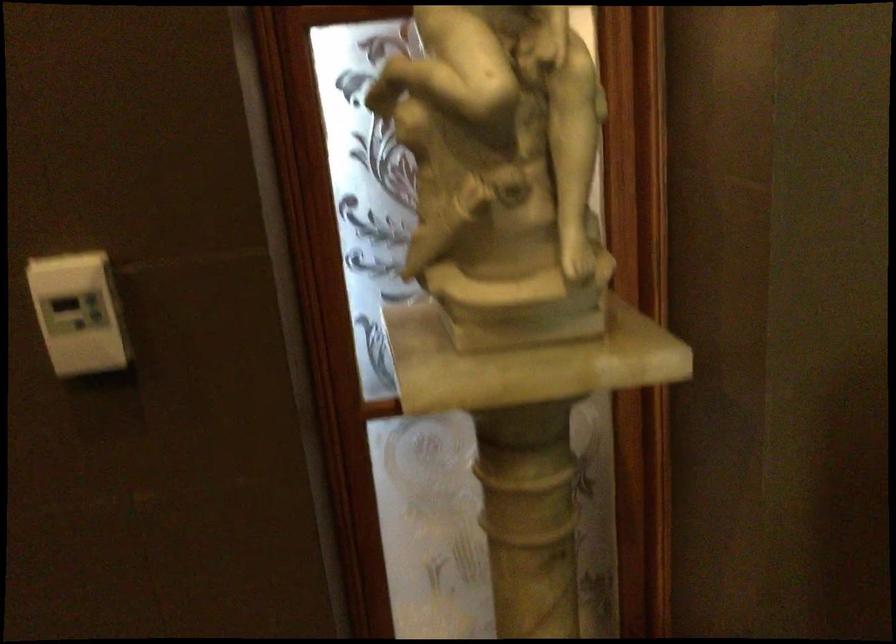
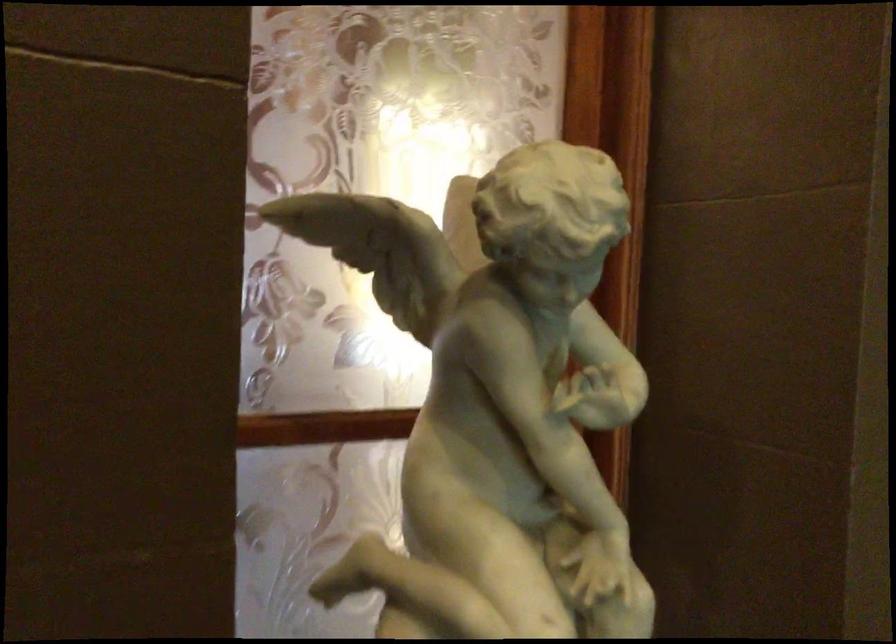
How did the camera likely rotate?

The camera rotated toward right-up.